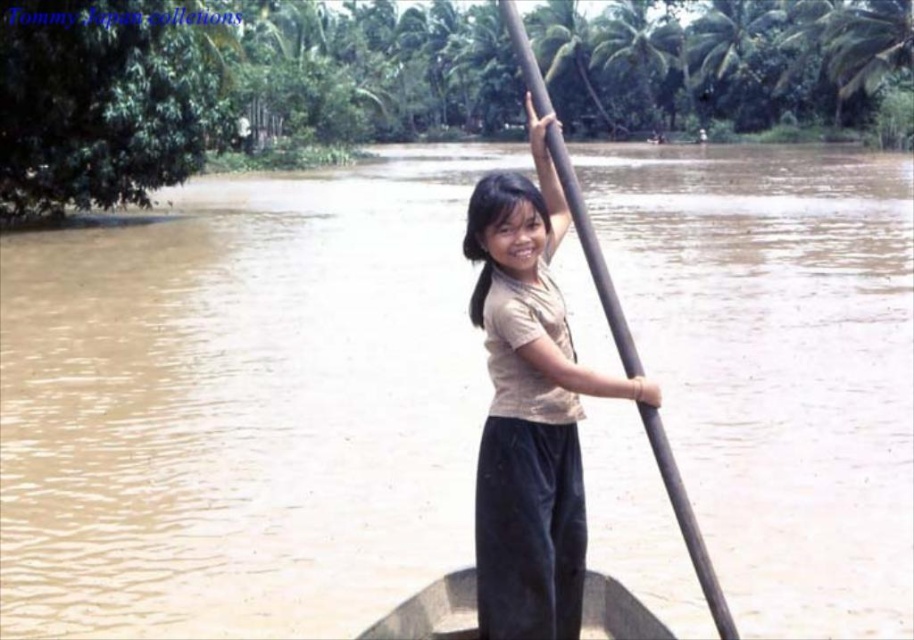
Question: Which object is farther from the camera taking this photo?

Choices:
 (A) dark brown wood canoe at center
 (B) matte brown shirt at center

Answer: (A)

Question: Which object is closer to the camera taking this photo?

Choices:
 (A) matte brown shirt at center
 (B) dark brown wood canoe at center

Answer: (A)

Question: Does matte brown shirt at center have a smaller size compared to dark brown wood canoe at center?

Choices:
 (A) no
 (B) yes

Answer: (A)

Question: From the image, what is the correct spatial relationship of matte brown shirt at center in relation to dark brown wood canoe at center?

Choices:
 (A) above
 (B) below

Answer: (A)

Question: Which point is farther to the camera?

Choices:
 (A) (399, 616)
 (B) (500, 561)

Answer: (A)

Question: Considering the relative positions of matte brown shirt at center and dark brown wood canoe at center in the image provided, where is matte brown shirt at center located with respect to dark brown wood canoe at center?

Choices:
 (A) above
 (B) below

Answer: (A)